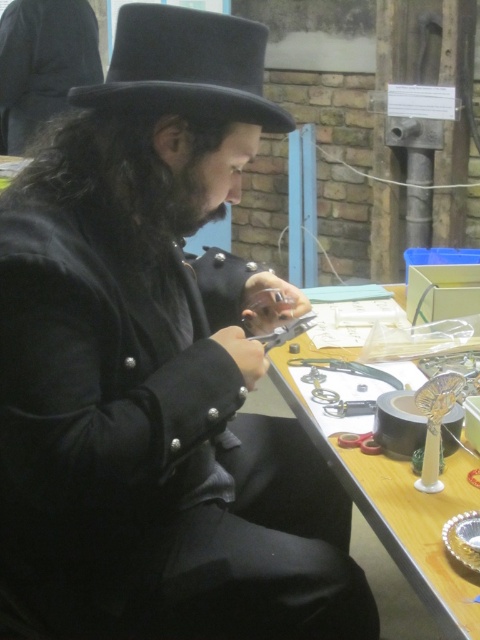
Can you confirm if wooden table at center is wider than black matte hat at upper left?

No.

Describe the element at coordinates (397, 506) in the screenshot. I see `wooden table at center` at that location.

Does point (460, 573) lie in front of point (13, 129)?

Yes, point (460, 573) is closer to viewer.

Where is `wooden table at center`? This screenshot has height=640, width=480. wooden table at center is located at coordinates (397, 506).

Who is positioned more to the left, black felt dress hat at upper center or wooden table at center?

black felt dress hat at upper center

Can you confirm if black felt dress hat at upper center is wider than wooden table at center?

Indeed, black felt dress hat at upper center has a greater width compared to wooden table at center.

Which is behind, point (232, 60) or point (396, 508)?

Positioned behind is point (396, 508).

Image resolution: width=480 pixels, height=640 pixels. Identify the location of black felt dress hat at upper center. (187, 67).

Which is more to the left, black felt dress hat at upper center or black matte hat at upper left?

black matte hat at upper left

Is point (74, 92) farther from camera compared to point (2, 74)?

No, (74, 92) is in front of (2, 74).

Does point (162, 8) lie behind point (99, 68)?

No, it is in front of (99, 68).

Locate an element on the screen. This screenshot has height=640, width=480. black felt dress hat at upper center is located at coordinates (187, 67).